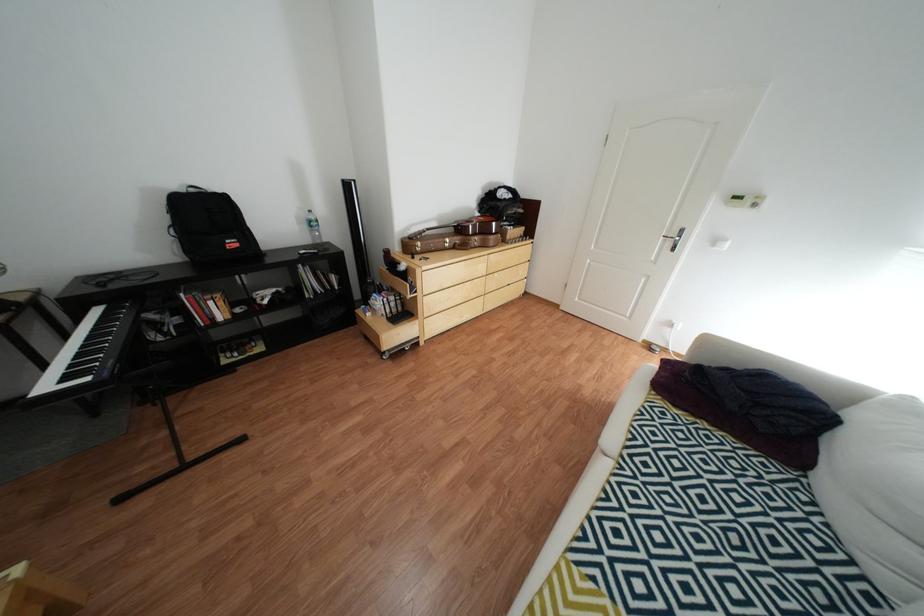
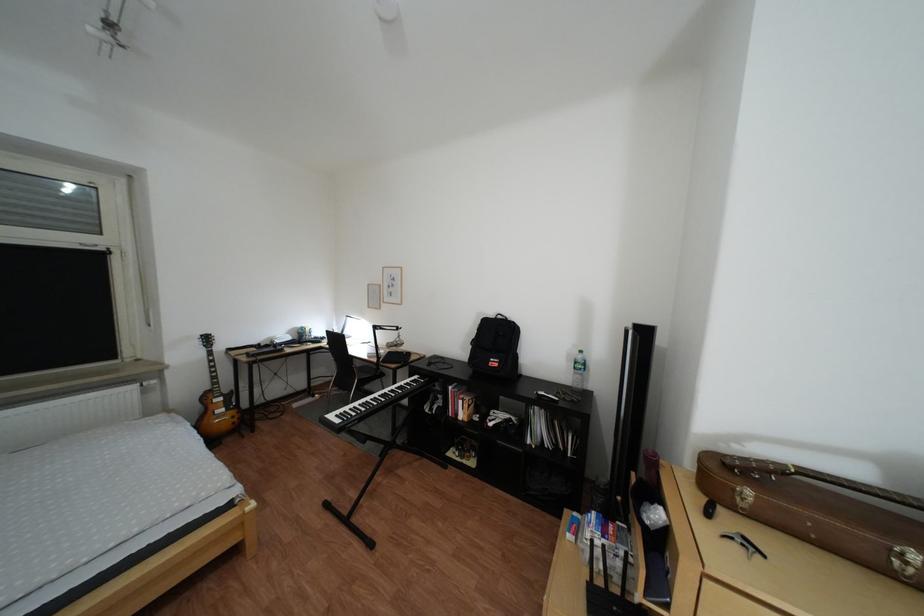
Question: I am providing you with two images of the same scene from different viewpoints. Which of the following objects are not visible in image2?

Choices:
 (A) chair sitting surface
 (B) green water bottle
 (C) black backpack
 (D) none of these

Answer: (D)